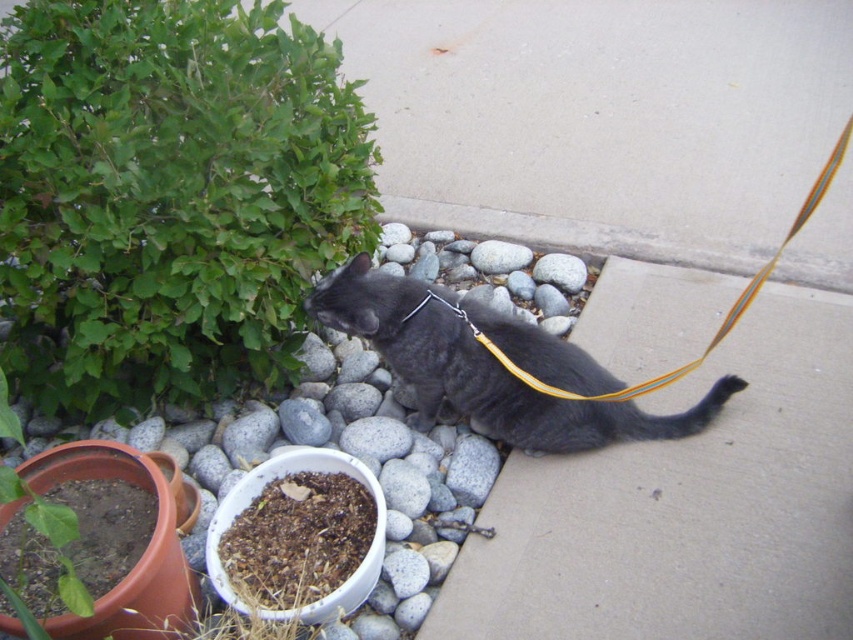
Looking at this image, is green leafy bush at upper left in front of shiny black cat at center?

Yes, green leafy bush at upper left is in front of shiny black cat at center.

Who is positioned more to the left, green leafy bush at upper left or shiny black cat at center?

green leafy bush at upper left is more to the left.

Is point (300, 170) positioned in front of point (479, 388)?

Yes, point (300, 170) is in front of point (479, 388).

Locate an element on the screen. The width and height of the screenshot is (853, 640). green leafy bush at upper left is located at coordinates click(169, 196).

Consider the image. Is green leafy bush at upper left further to the viewer compared to brown soil at lower left?

Yes, green leafy bush at upper left is behind brown soil at lower left.

Can you confirm if green leafy bush at upper left is positioned to the left of brown soil at lower left?

Yes, green leafy bush at upper left is to the left of brown soil at lower left.

Does point (0, 177) come closer to viewer compared to point (265, 596)?

That is False.

Where is `green leafy bush at upper left`? green leafy bush at upper left is located at coordinates (169, 196).

Can you confirm if gray concrete pavement at lower right is wider than shiny black cat at center?

Yes.

I want to click on gray concrete pavement at lower right, so click(x=685, y=508).